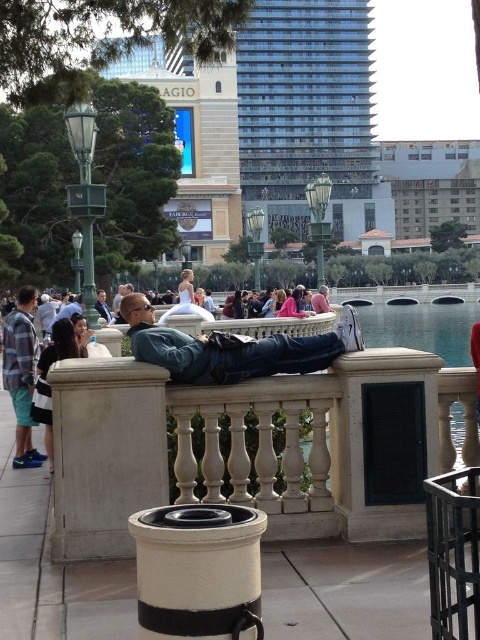
Can you confirm if denim jacket at center is shorter than matte black jacket at center?

Incorrect, denim jacket at center's height does not fall short of matte black jacket at center's.

Is denim jacket at center above matte black jacket at center?

Incorrect, denim jacket at center is not positioned above matte black jacket at center.

From the picture: Who is more forward, (290, 358) or (111, 320)?

Positioned in front is point (290, 358).

Identify the location of denim jacket at center. (232, 348).

Consider the image. Does white stone balustrade at center have a lesser width compared to plaid flannel shirt at left?

In fact, white stone balustrade at center might be wider than plaid flannel shirt at left.

Between white stone balustrade at center and plaid flannel shirt at left, which one appears on the right side from the viewer's perspective?

white stone balustrade at center is more to the right.

Does point (104, 513) come farther from viewer compared to point (27, 467)?

No, (104, 513) is in front of (27, 467).

Where is `white stone balustrade at center`? The height and width of the screenshot is (640, 480). white stone balustrade at center is located at coordinates (239, 448).

Looking at this image, who is taller, plaid flannel shirt at left or matte black jacket at center?

plaid flannel shirt at left

Can you confirm if plaid flannel shirt at left is taller than matte black jacket at center?

Yes, plaid flannel shirt at left is taller than matte black jacket at center.

Which is behind, point (23, 326) or point (105, 296)?

The point (105, 296) is more distant.

The height and width of the screenshot is (640, 480). In order to click on plaid flannel shirt at left in this screenshot , I will do `click(22, 374)`.